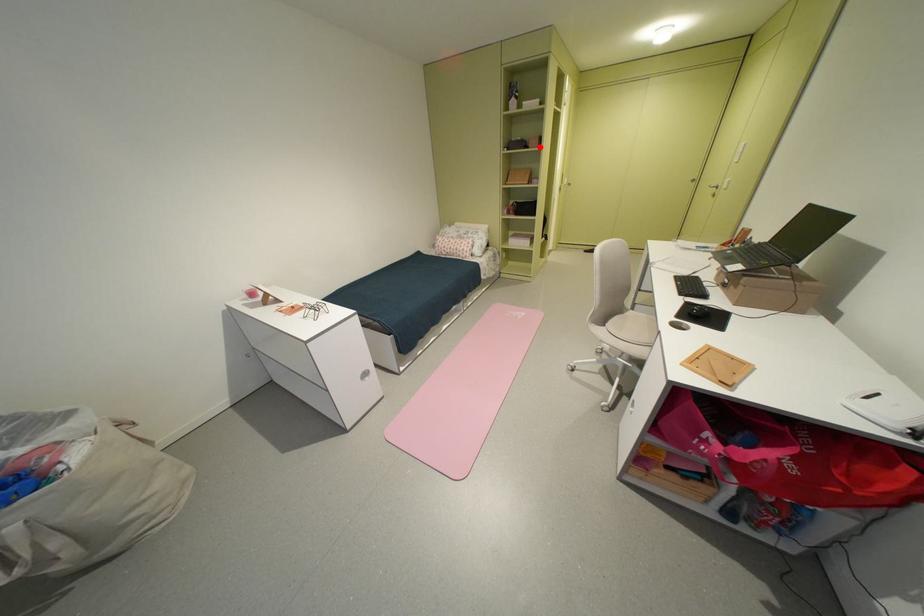
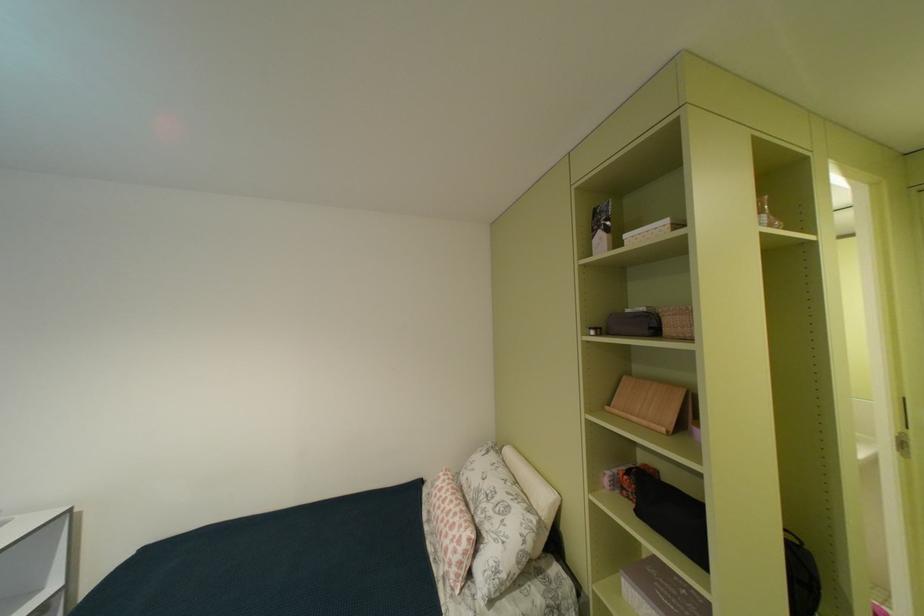
Where in the second image is the point corresponding to the highlighted location from the first image?

(675, 331)